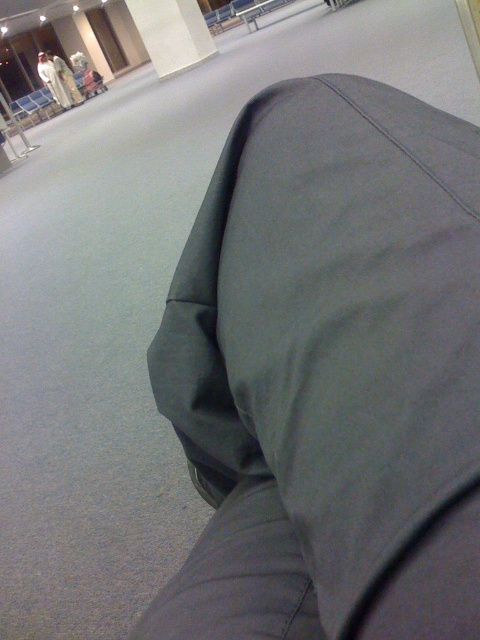
How distant is gray fabric pants at lower right from light beige fabric coat at upper left?

gray fabric pants at lower right is 50.39 feet from light beige fabric coat at upper left.

Can you confirm if gray fabric pants at lower right is bigger than light beige fabric coat at upper left?

Incorrect, gray fabric pants at lower right is not larger than light beige fabric coat at upper left.

The image size is (480, 640). What do you see at coordinates (328, 372) in the screenshot?
I see `gray fabric pants at lower right` at bounding box center [328, 372].

This screenshot has height=640, width=480. I want to click on gray fabric pants at lower right, so click(x=328, y=372).

Looking at this image, who is more distant from viewer, (x=54, y=81) or (x=73, y=100)?

Positioned behind is point (x=73, y=100).

Is light beige fabric coat at upper left to the left of white cotton robe at upper left from the viewer's perspective?

Indeed, light beige fabric coat at upper left is positioned on the left side of white cotton robe at upper left.

Identify the location of light beige fabric coat at upper left. The image size is (480, 640). (52, 81).

Is gray fabric pants at lower right taller than white cotton robe at upper left?

No.

Is gray fabric pants at lower right above white cotton robe at upper left?

Incorrect, gray fabric pants at lower right is not positioned above white cotton robe at upper left.

Describe the element at coordinates (328, 372) in the screenshot. The width and height of the screenshot is (480, 640). I see `gray fabric pants at lower right` at that location.

Image resolution: width=480 pixels, height=640 pixels. What are the coordinates of `gray fabric pants at lower right` in the screenshot? It's located at (328, 372).